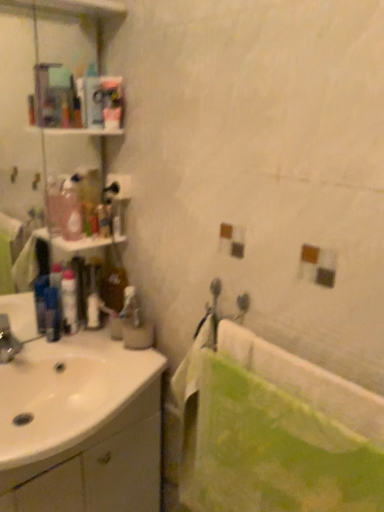
Locate an element on the screen. The width and height of the screenshot is (384, 512). vacant area on top of translucent plastic bottles at left (from a real-world perspective) is located at coordinates (86, 234).